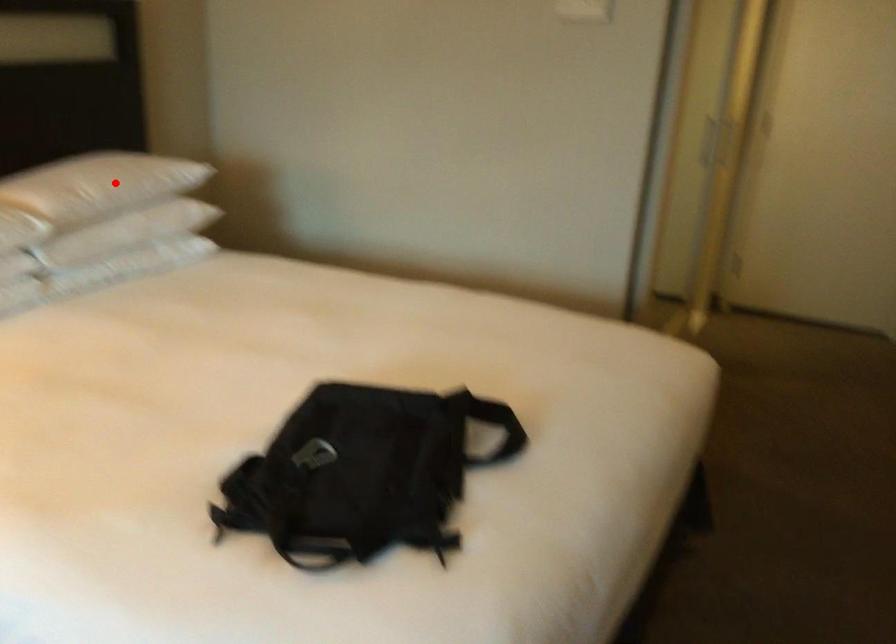
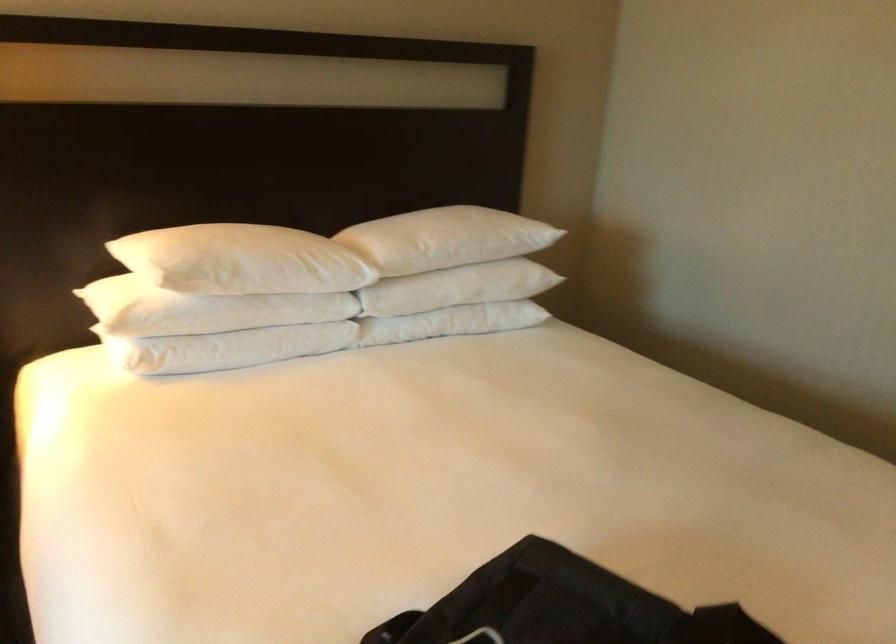
Find the pixel in the second image that matches the highlighted location in the first image.

(449, 238)